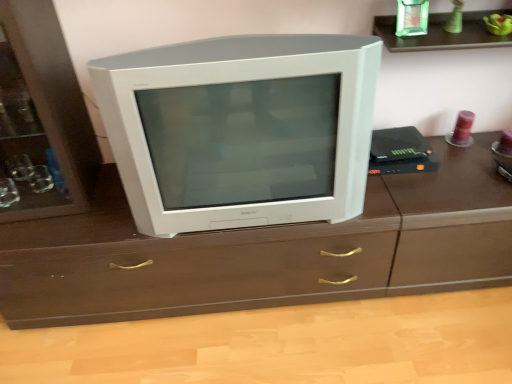
Find the location of `white plastic television at center`. white plastic television at center is located at coordinates point(241,129).

Consider the image. Measure the distance between white plastic television at center and camera.

The depth of white plastic television at center is 1.09 meters.

What is the approximate width of white plastic television at center?

It is 20.89 inches.

The height and width of the screenshot is (384, 512). What do you see at coordinates (241, 129) in the screenshot?
I see `white plastic television at center` at bounding box center [241, 129].

The width and height of the screenshot is (512, 384). In order to click on white plastic television at center in this screenshot , I will do `click(241, 129)`.